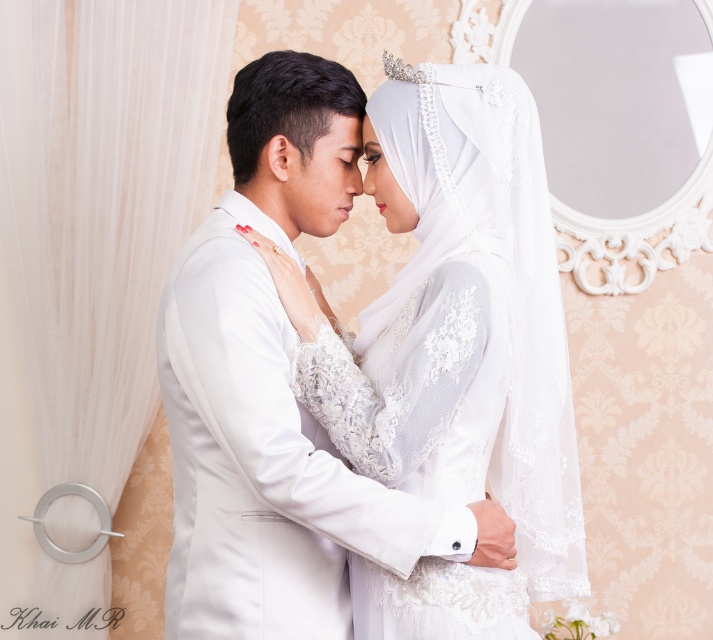
Question: Which point is farther to the camera?

Choices:
 (A) white lace dress at center
 (B) matte white forehead at center

Answer: (B)

Question: Can you confirm if white lace dress at center is positioned to the right of matte white forehead at center?

Choices:
 (A) yes
 (B) no

Answer: (A)

Question: Which of the following is the closest to the observer?

Choices:
 (A) white lace dress at center
 (B) lace fabric dress at center

Answer: (B)

Question: From the image, what is the correct spatial relationship of white lace dress at center in relation to lace fabric dress at center?

Choices:
 (A) right
 (B) left

Answer: (A)

Question: Can you confirm if lace fabric dress at center is positioned to the left of matte white forehead at center?

Choices:
 (A) no
 (B) yes

Answer: (A)

Question: Among these points, which one is farthest from the camera?

Choices:
 (A) (361, 323)
 (B) (343, 145)

Answer: (A)